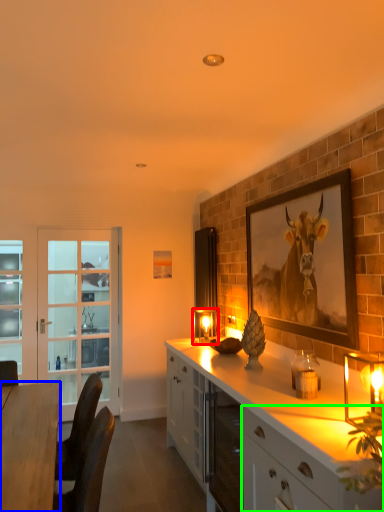
Question: Estimate the real-world distances between objects in this image. Which object is farther from candle holder (highlighted by a red box), desk (highlighted by a blue box) or cabinetry (highlighted by a green box)?

Choices:
 (A) desk
 (B) cabinetry

Answer: (B)